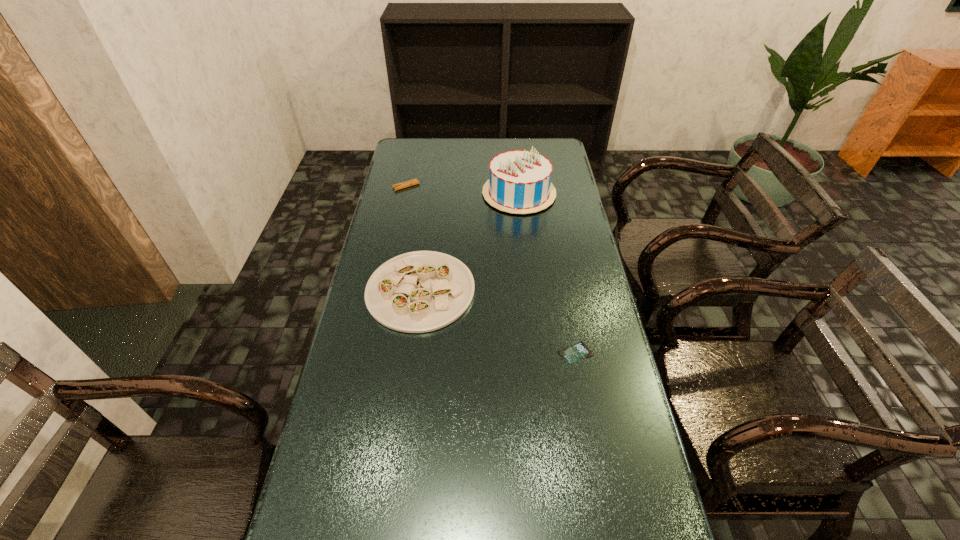
Find the location of `platter positioned at the left edge`. platter positioned at the left edge is located at coordinates coord(421,291).

Where is `clothespin that is at the left edge`? The image size is (960, 540). clothespin that is at the left edge is located at coordinates (405, 184).

The width and height of the screenshot is (960, 540). I want to click on birthday cake that is at the right edge, so click(519, 182).

This screenshot has width=960, height=540. Find the location of `identity card present at the right edge`. identity card present at the right edge is located at coordinates (577, 352).

You are a GUI agent. You are given a task and a screenshot of the screen. Output one action in this format:
    pyautogui.click(x=<x>, y=<y>)
    Task: Click on the free location at the left edge
    
    Given the screenshot: What is the action you would take?
    pyautogui.click(x=363, y=278)

This screenshot has width=960, height=540. What are the coordinates of `vacant space at the far left corner of the desktop` in the screenshot? It's located at (402, 150).

At what (x,y) coordinates should I click in order to perform the action: click on free spot between the shortest object and the birthday cake. Please return your answer as a coordinate pair (x, y). Image resolution: width=960 pixels, height=540 pixels. Looking at the image, I should click on (547, 273).

This screenshot has width=960, height=540. I want to click on free point between the identity card and the second tallest object, so click(498, 321).

You are a GUI agent. You are given a task and a screenshot of the screen. Output one action in this format:
    pyautogui.click(x=<x>, y=<y>)
    Task: Click on the vacant region between the third tallest object and the third farthest object
    This screenshot has height=540, width=960.
    Given the screenshot: What is the action you would take?
    pyautogui.click(x=414, y=238)

Image resolution: width=960 pixels, height=540 pixels. Identify the location of empty location between the shortest object and the third shortest object. [x=498, y=321].